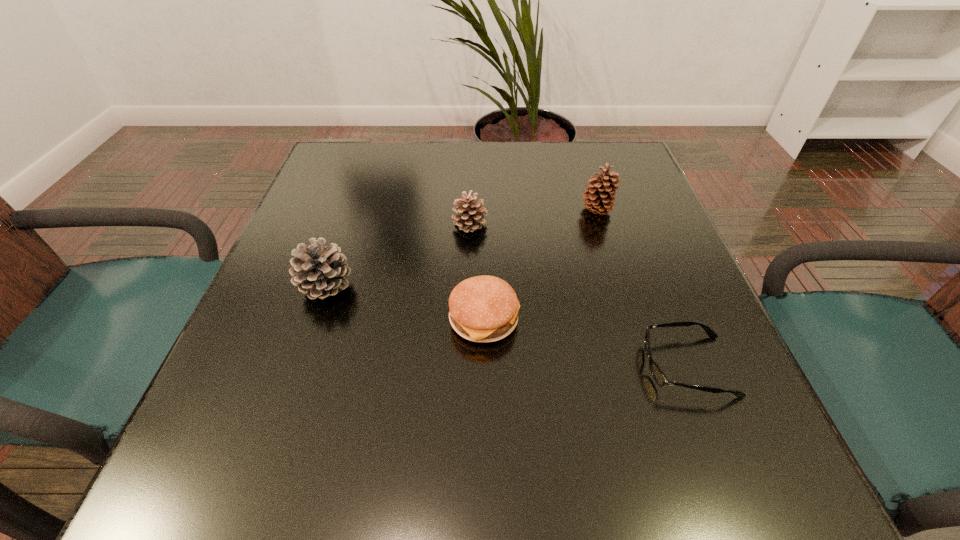
Where is `vacant space situated on the front-facing side of the spectacles`? The height and width of the screenshot is (540, 960). vacant space situated on the front-facing side of the spectacles is located at coordinates pos(436,366).

Locate an element on the screen. The height and width of the screenshot is (540, 960). vacant region located on the front-facing side of the spectacles is located at coordinates (448, 366).

Find the location of `vacant space located 0.360m on the front-facing side of the spectacles`. vacant space located 0.360m on the front-facing side of the spectacles is located at coordinates (417, 366).

I want to click on object that is at the left edge, so click(319, 271).

At what (x,y) coordinates should I click in order to perform the action: click on pinecone located in the right edge section of the desktop. Please return your answer as a coordinate pair (x, y). The height and width of the screenshot is (540, 960). Looking at the image, I should click on (599, 199).

At what (x,y) coordinates should I click in order to perform the action: click on spectacles present at the right edge. Please return your answer as a coordinate pair (x, y). Looking at the image, I should click on (658, 375).

This screenshot has width=960, height=540. What are the coordinates of `vacant region at the far edge of the desktop` in the screenshot? It's located at click(501, 159).

In the image, there is a desktop. At what (x,y) coordinates should I click in order to perform the action: click on vacant space at the near edge. Please return your answer as a coordinate pair (x, y). The height and width of the screenshot is (540, 960). Looking at the image, I should click on pyautogui.click(x=516, y=458).

The width and height of the screenshot is (960, 540). In the image, there is a desktop. In order to click on vacant space at the left edge in this screenshot , I will do `click(314, 329)`.

In the image, there is a desktop. What are the coordinates of `vacant area at the right edge` in the screenshot? It's located at (624, 221).